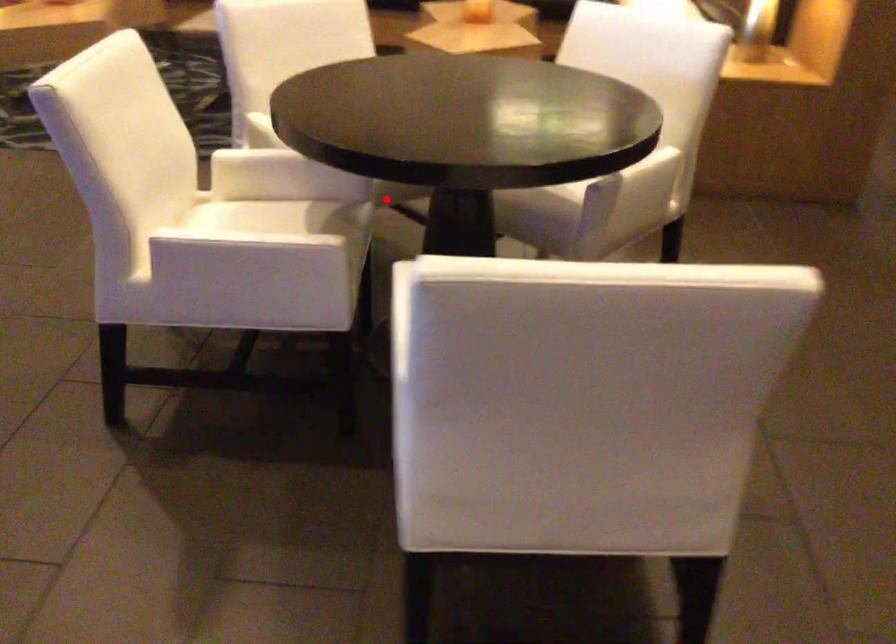
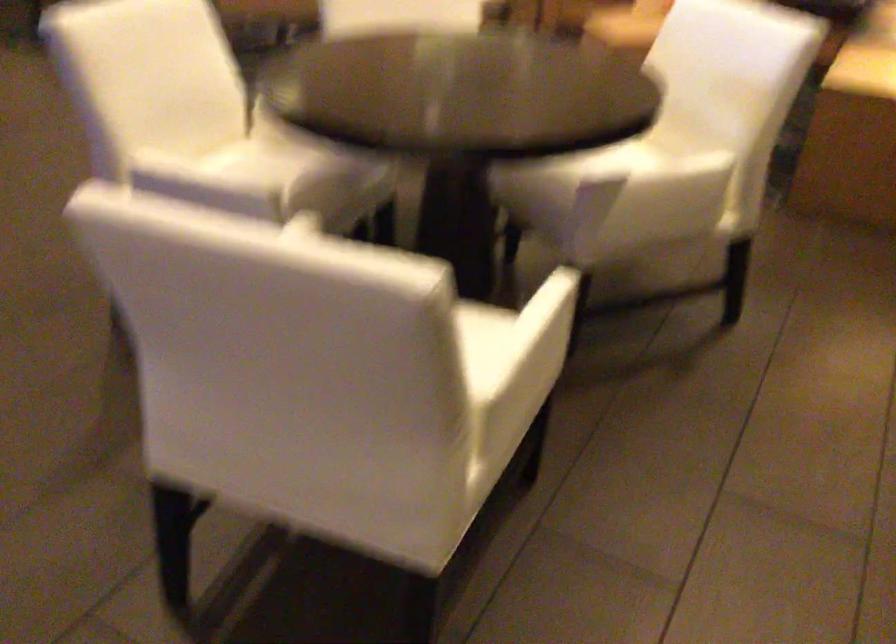
Question: I am providing you with two images of the same scene from different viewpoints. A red point is marked on the first image. Can you still see the location of the red point in image 2?

Choices:
 (A) Yes
 (B) No

Answer: (B)